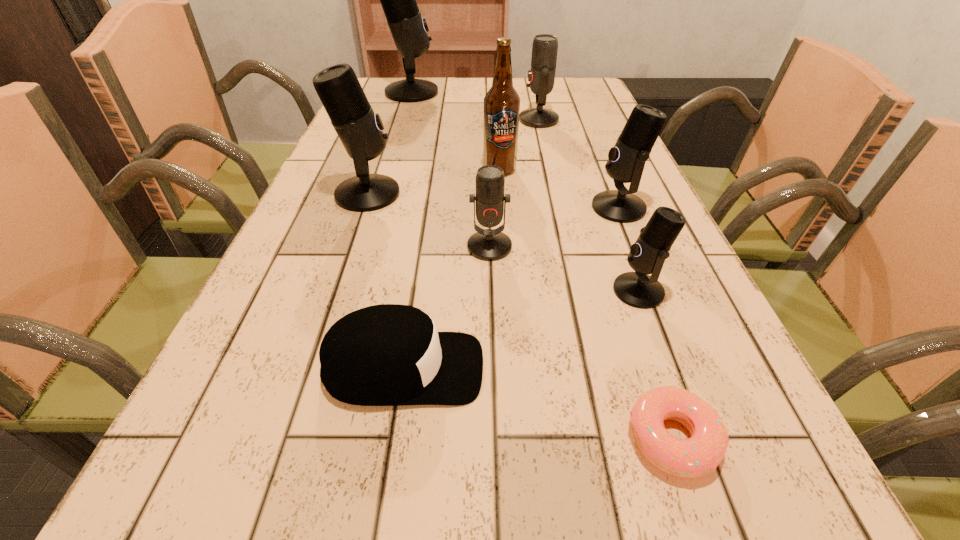
Image resolution: width=960 pixels, height=540 pixels. I want to click on the farthest black microphone, so coord(409,29).

This screenshot has width=960, height=540. Find the location of `the tallest microphone`. the tallest microphone is located at coordinates (409, 29).

Find the location of a particular element. The height and width of the screenshot is (540, 960). beer bottle is located at coordinates (502, 103).

The width and height of the screenshot is (960, 540). Identify the location of the second tallest microphone. 360,130.

Find the location of a particular element. The image size is (960, 540). the third biggest black microphone is located at coordinates (626, 160).

This screenshot has height=540, width=960. In order to click on the third microphone from right to left in this screenshot , I will do `click(541, 75)`.

I want to click on the fifth nearest microphone, so click(x=541, y=75).

What are the coordinates of `the nearest black microphone` in the screenshot? It's located at (647, 255).

Locate an element on the screen. This screenshot has height=540, width=960. the smallest black microphone is located at coordinates (647, 255).

Image resolution: width=960 pixels, height=540 pixels. I want to click on the left red microphone, so click(x=486, y=244).